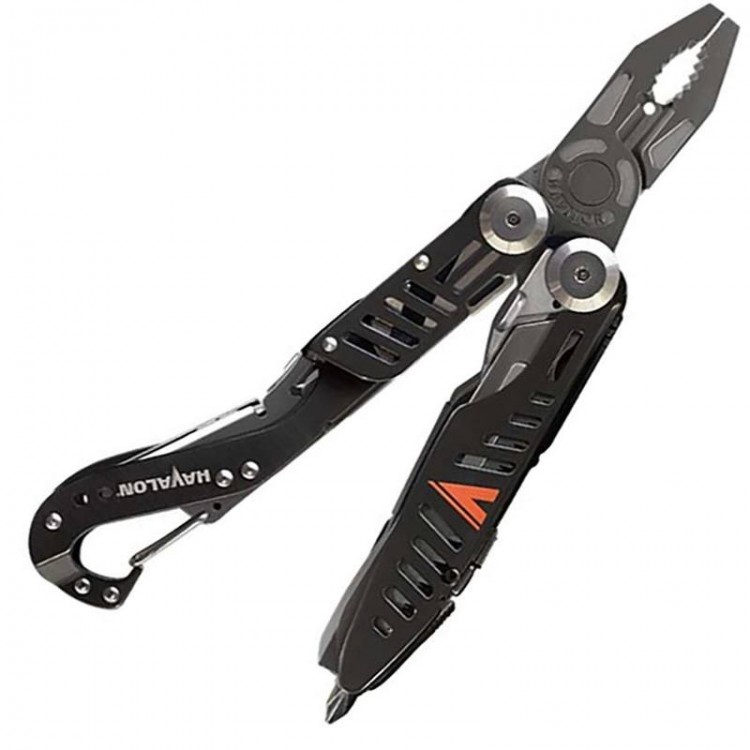
This screenshot has width=750, height=750. In order to click on hook in this screenshot , I will do `click(128, 564)`.